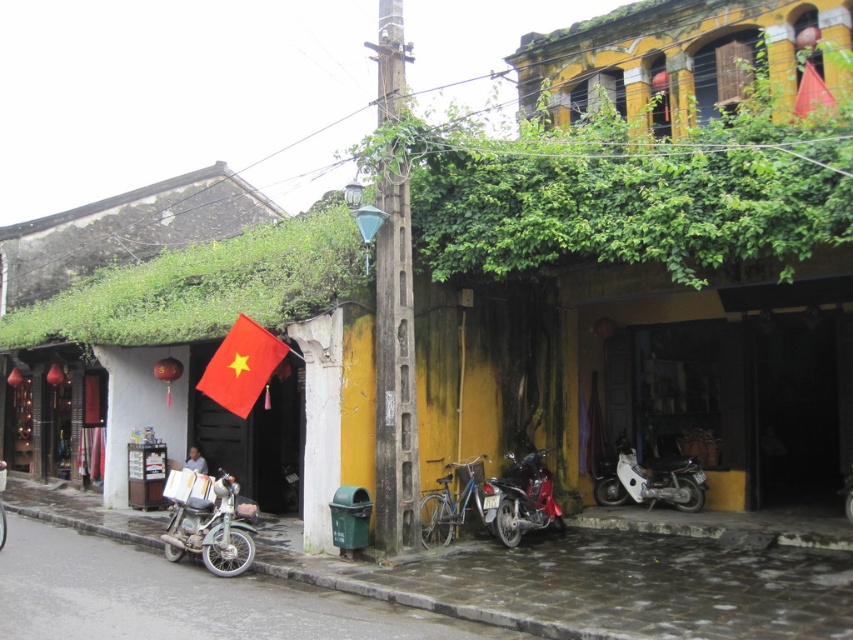
Based on the photo, who is more distant from viewer, (813, 172) or (241, 416)?

The point (241, 416) is behind.

The width and height of the screenshot is (853, 640). Describe the element at coordinates (627, 192) in the screenshot. I see `green leafy vines at upper center` at that location.

Locate an element on the screen. This screenshot has width=853, height=640. green leafy vines at upper center is located at coordinates (627, 192).

Is wooden pole at center further to the viewer compared to blue metallic bicycle at center?

No, it is in front of blue metallic bicycle at center.

Image resolution: width=853 pixels, height=640 pixels. What do you see at coordinates (393, 371) in the screenshot? I see `wooden pole at center` at bounding box center [393, 371].

Image resolution: width=853 pixels, height=640 pixels. I want to click on wooden pole at center, so click(393, 371).

Is green leafy roof at upper left positioned before wooden pole at center?

That is False.

Between point (264, 276) and point (393, 484), which one is positioned behind?

Point (264, 276)

Identify the location of green leafy roof at upper left. (204, 288).